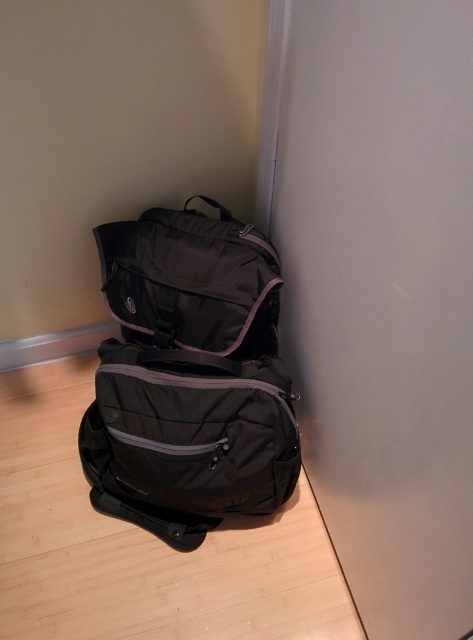
Based on the photo, does matte black backpack at lower left have a larger size compared to matte black bag at upper left?

Yes.

Can you confirm if matte black backpack at lower left is taller than matte black bag at upper left?

A: Yes.

You are a GUI agent. You are given a task and a screenshot of the screen. Output one action in this format:
    pyautogui.click(x=<x>, y=<y>)
    Task: Click on the matte black backpack at lower left
    
    Given the screenshot: What is the action you would take?
    pyautogui.click(x=186, y=440)